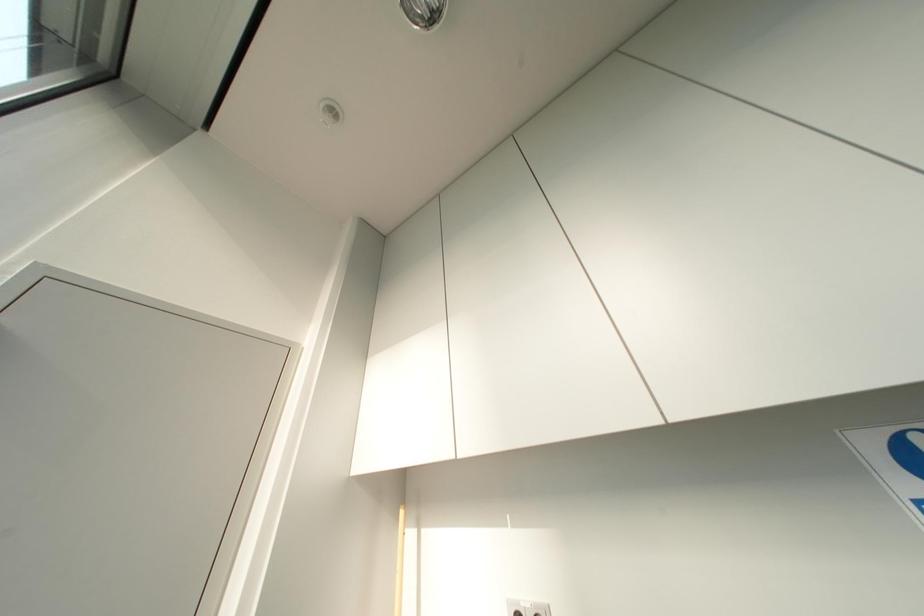
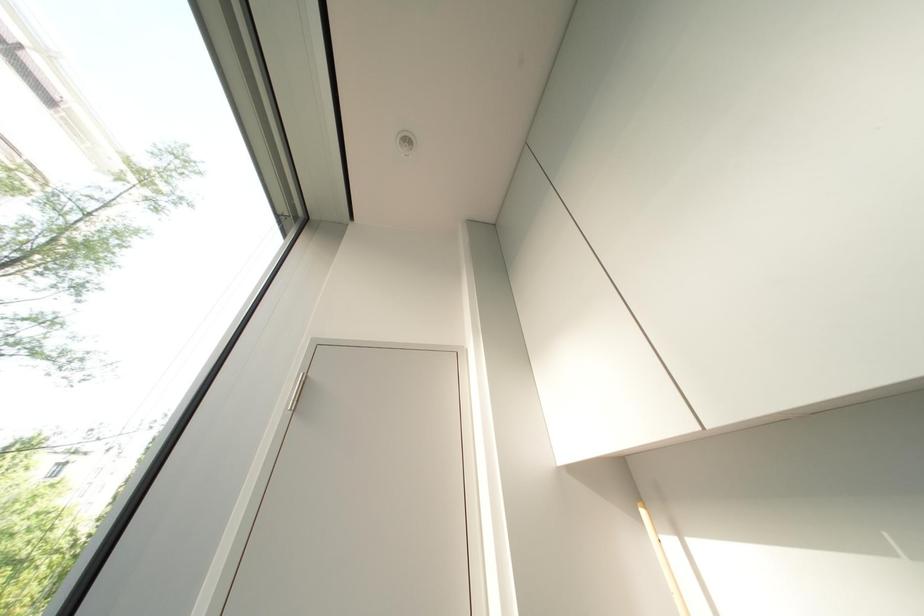
Question: The camera is either moving clockwise (left) or counter-clockwise (right) around the object. The first image is from the beginning of the video and the second image is from the end. Is the camera moving left or right when shooting the video?

Choices:
 (A) Left
 (B) Right

Answer: (B)